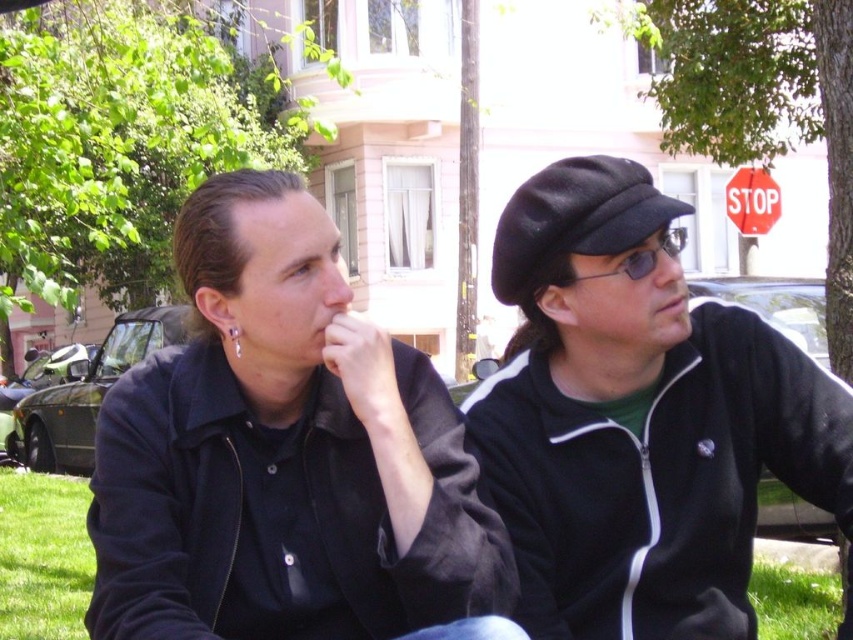
You are a photographer trying to capture a photo of the black matte jacket at left and the red plastic stop sign at upper right. The camera has a limited field of view. Which object should you focus on first if you want to ensure both are fully visible in the frame?

The black matte jacket at left is wider than the red plastic stop sign at upper right. To ensure both are fully visible, focus on the wider object first, which is the black matte jacket at left, then adjust the frame to include the smaller red plastic stop sign at upper right.

You are taking a photo of the two people sitting on the bench. You want to focus on the person closer to the camera. Which point should you use for focus? The options are point A at coordinates point (599, 616) and point B at coordinates point (747, 230).

Point A at coordinates point (599, 616) is closer to the camera, so you should use point A at coordinates point (599, 616) for focus.